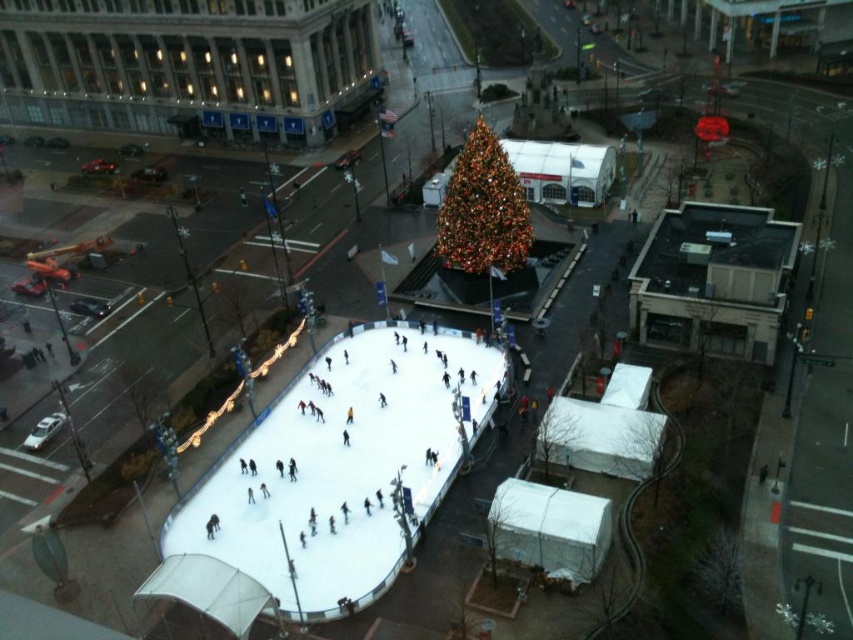
Question: Observing the image, what is the correct spatial positioning of white smooth ice skating rink at center in reference to iridescent glass christmas tree at center?

Choices:
 (A) right
 (B) left

Answer: (B)

Question: Does white smooth ice skating rink at center have a lesser width compared to iridescent glass christmas tree at center?

Choices:
 (A) no
 (B) yes

Answer: (A)

Question: From the image, what is the correct spatial relationship of white smooth ice skating rink at center in relation to iridescent glass christmas tree at center?

Choices:
 (A) right
 (B) left

Answer: (B)

Question: Which object appears closest to the camera in this image?

Choices:
 (A) iridescent glass christmas tree at center
 (B) white smooth ice skating rink at center

Answer: (B)

Question: Among these objects, which one is nearest to the camera?

Choices:
 (A) iridescent glass christmas tree at center
 (B) white smooth ice skating rink at center

Answer: (B)